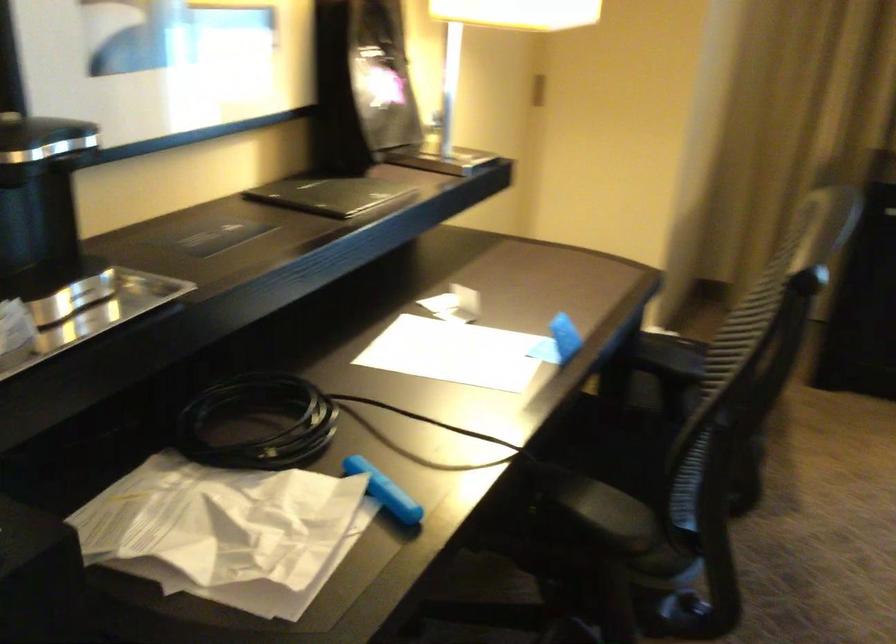
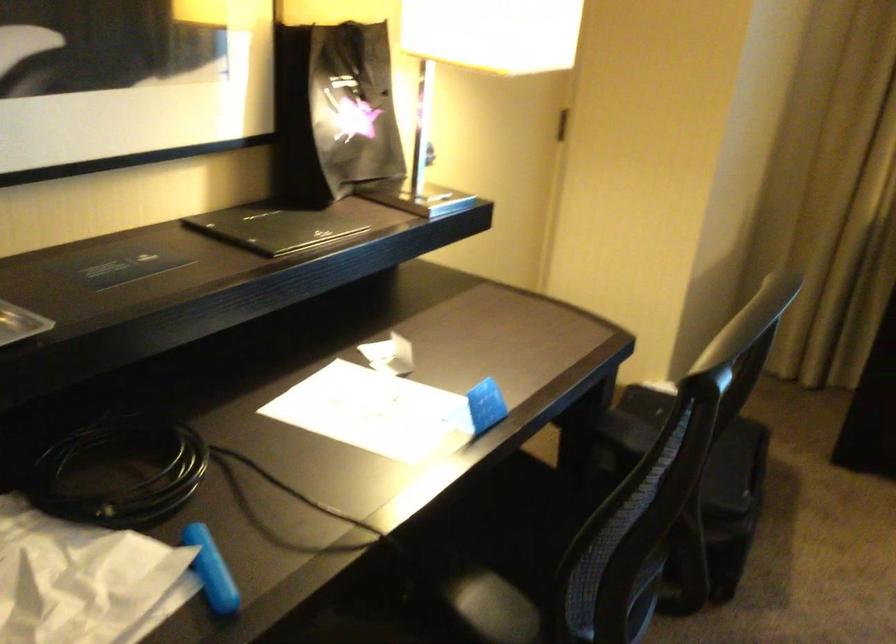
In the second image, find the point that corresponds to [737,531] in the first image.

(709, 618)